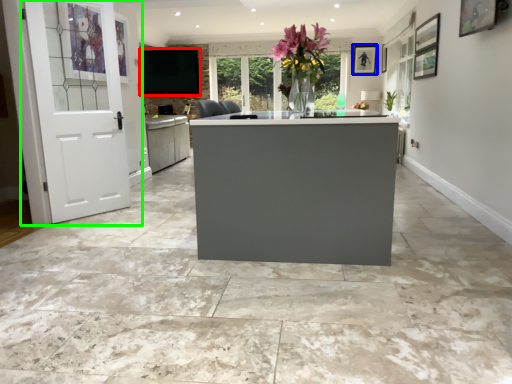
Question: Which object is positioned closest to window screen (highlighted by a red box)? Select from picture frame (highlighted by a blue box) and door (highlighted by a green box).

Choices:
 (A) picture frame
 (B) door

Answer: (B)